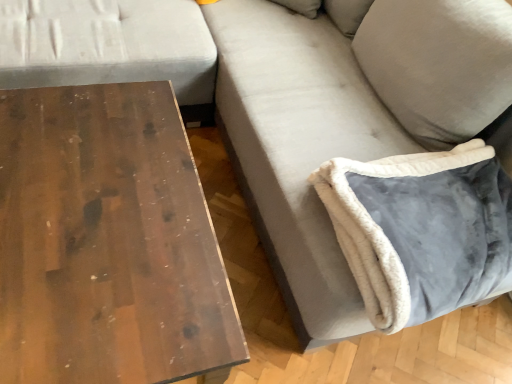
Where is `free space above wooden table at left (from a real-world perspective)`? This screenshot has height=384, width=512. free space above wooden table at left (from a real-world perspective) is located at coordinates (89, 205).